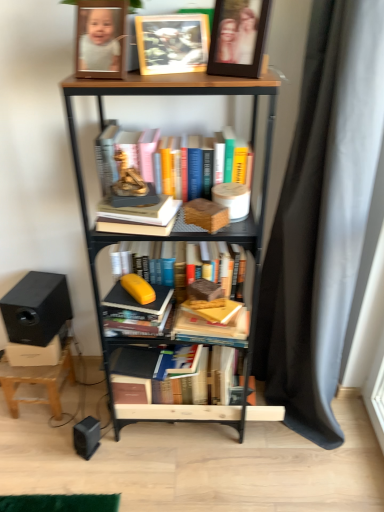
Locate an element on the screen. free space between wooden bookcase at center and black plastic speaker at lower left, which appears as the 2th speaker when viewed from the left is located at coordinates (142, 446).